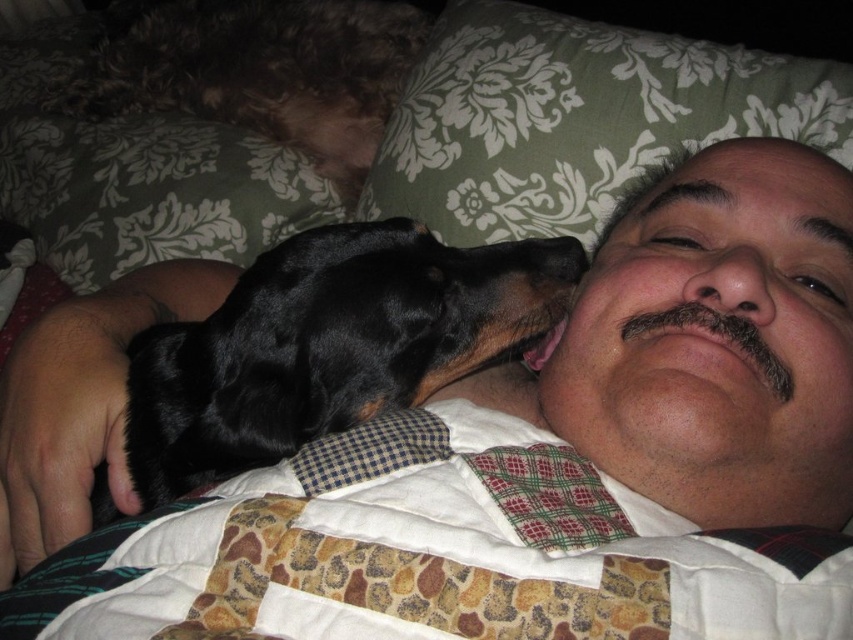
The height and width of the screenshot is (640, 853). Find the location of `green floral fabric at upper center`. green floral fabric at upper center is located at coordinates (576, 118).

Is green floral fabric at upper center smaller than fuzzy brown dog at upper left?

Incorrect, green floral fabric at upper center is not smaller in size than fuzzy brown dog at upper left.

Image resolution: width=853 pixels, height=640 pixels. Describe the element at coordinates (576, 118) in the screenshot. I see `green floral fabric at upper center` at that location.

The image size is (853, 640). Find the location of `green floral fabric at upper center`. green floral fabric at upper center is located at coordinates (576, 118).

Who is more forward, [143,416] or [309,99]?

Point [143,416]

Can you confirm if black fur dog at center is positioned above fuzzy brown dog at upper left?

Actually, black fur dog at center is below fuzzy brown dog at upper left.

The width and height of the screenshot is (853, 640). Describe the element at coordinates (329, 344) in the screenshot. I see `black fur dog at center` at that location.

You are a GUI agent. You are given a task and a screenshot of the screen. Output one action in this format:
    pyautogui.click(x=<x>, y=<y>)
    Task: Click on the black fur dog at center
    
    Given the screenshot: What is the action you would take?
    pyautogui.click(x=329, y=344)

Which is in front, point (498, 264) or point (786, 61)?

Positioned in front is point (498, 264).

This screenshot has width=853, height=640. Describe the element at coordinates (329, 344) in the screenshot. I see `black fur dog at center` at that location.

Does point (358, 308) lie in front of point (476, 179)?

Yes.

This screenshot has height=640, width=853. Identify the location of black fur dog at center. (329, 344).